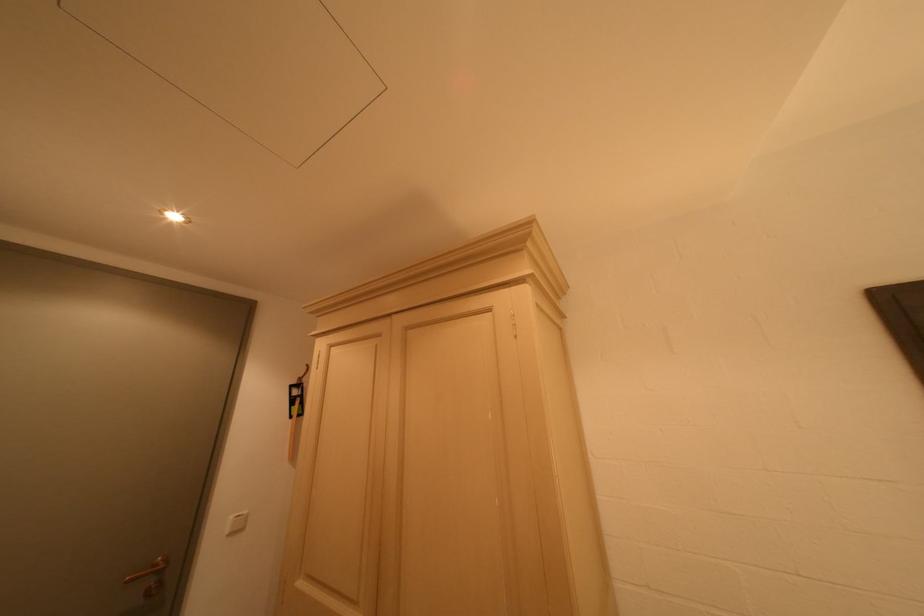
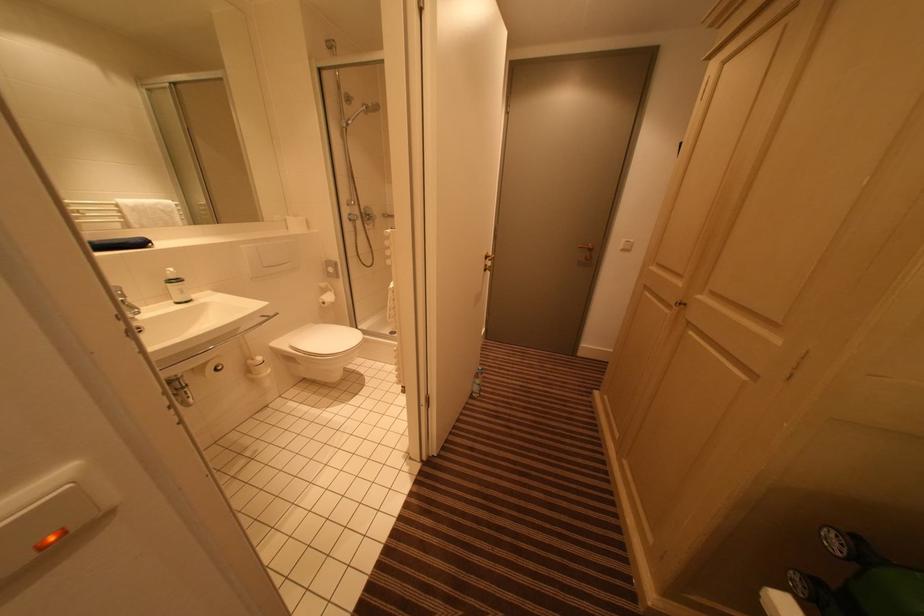
The images are taken continuously from a first-person perspective. In which direction is your viewpoint rotating?

The rotation direction of the camera is left-down.